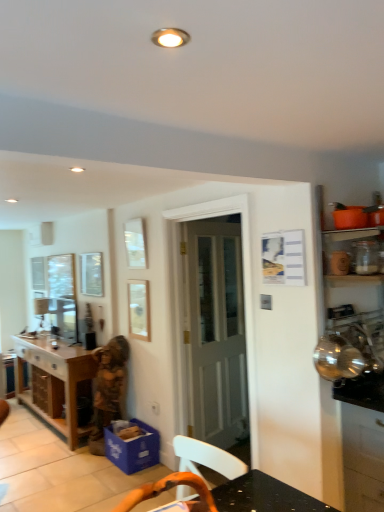
Question: Is translucent glass jar at upper right not close to blue cardboard box at lower center, the 1th cabinetry when ordered from back to front?

Choices:
 (A) no
 (B) yes

Answer: (B)

Question: Is translucent glass jar at upper right thinner than blue cardboard box at lower center, positioned as the 2th cabinetry in right-to-left order?

Choices:
 (A) yes
 (B) no

Answer: (A)

Question: Considering the relative positions of translucent glass jar at upper right and blue cardboard box at lower center, positioned as the 2th cabinetry in right-to-left order, in the image provided, is translucent glass jar at upper right in front of blue cardboard box at lower center, positioned as the 2th cabinetry in right-to-left order,?

Choices:
 (A) yes
 (B) no

Answer: (A)

Question: From a real-world perspective, is translucent glass jar at upper right physically above blue cardboard box at lower center, placed as the first cabinetry when sorted from left to right?

Choices:
 (A) no
 (B) yes

Answer: (B)

Question: Could you tell me if translucent glass jar at upper right is turned towards blue cardboard box at lower center, positioned as the 2th cabinetry in right-to-left order?

Choices:
 (A) yes
 (B) no

Answer: (B)

Question: Is satin black cabinet at right, the 1th cabinetry positioned from the front, in front of or behind blue cardboard box at lower center, positioned as the 2th cabinetry in right-to-left order, in the image?

Choices:
 (A) front
 (B) behind

Answer: (A)

Question: From the image's perspective, is satin black cabinet at right, the 1th cabinetry positioned from the front, above or below blue cardboard box at lower center, the second cabinetry when ordered from front to back?

Choices:
 (A) below
 (B) above

Answer: (B)

Question: Do you think satin black cabinet at right, marked as the 2th cabinetry in a back-to-front arrangement, is within blue cardboard box at lower center, the 1th cabinetry when ordered from back to front, or outside of it?

Choices:
 (A) inside
 (B) outside

Answer: (B)

Question: Is satin black cabinet at right, marked as the 2th cabinetry in a back-to-front arrangement, bigger or smaller than blue cardboard box at lower center, the 1th cabinetry when ordered from back to front?

Choices:
 (A) big
 (B) small

Answer: (A)

Question: Relative to satin black cabinet at right, which is the second cabinetry in left-to-right order, is wooden statue at center in front or behind?

Choices:
 (A) front
 (B) behind

Answer: (B)

Question: Based on their sizes in the image, would you say wooden statue at center is bigger or smaller than satin black cabinet at right, which is the second cabinetry in left-to-right order?

Choices:
 (A) big
 (B) small

Answer: (B)

Question: Visually, is wooden statue at center positioned to the left or to the right of satin black cabinet at right, marked as the 2th cabinetry in a back-to-front arrangement?

Choices:
 (A) right
 (B) left

Answer: (B)

Question: From the image's perspective, is wooden statue at center above or below satin black cabinet at right, marked as the 2th cabinetry in a back-to-front arrangement?

Choices:
 (A) below
 (B) above

Answer: (A)

Question: In the image, is white wooden door at center positioned in front of or behind translucent glass jar at upper right?

Choices:
 (A) front
 (B) behind

Answer: (B)

Question: From the image's perspective, is white wooden door at center positioned above or below translucent glass jar at upper right?

Choices:
 (A) below
 (B) above

Answer: (A)